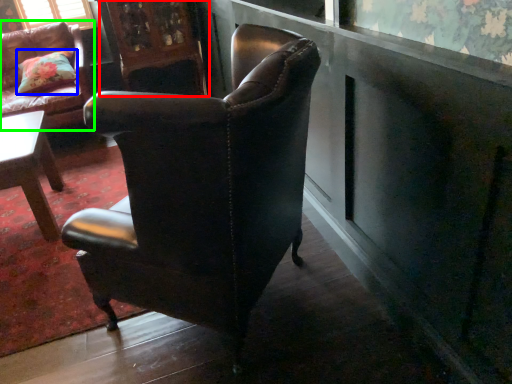
Question: Based on their relative distances, which object is farther from armoire (highlighted by a red box)? Choose from pillow (highlighted by a blue box) and chair (highlighted by a green box).

Choices:
 (A) pillow
 (B) chair

Answer: (A)